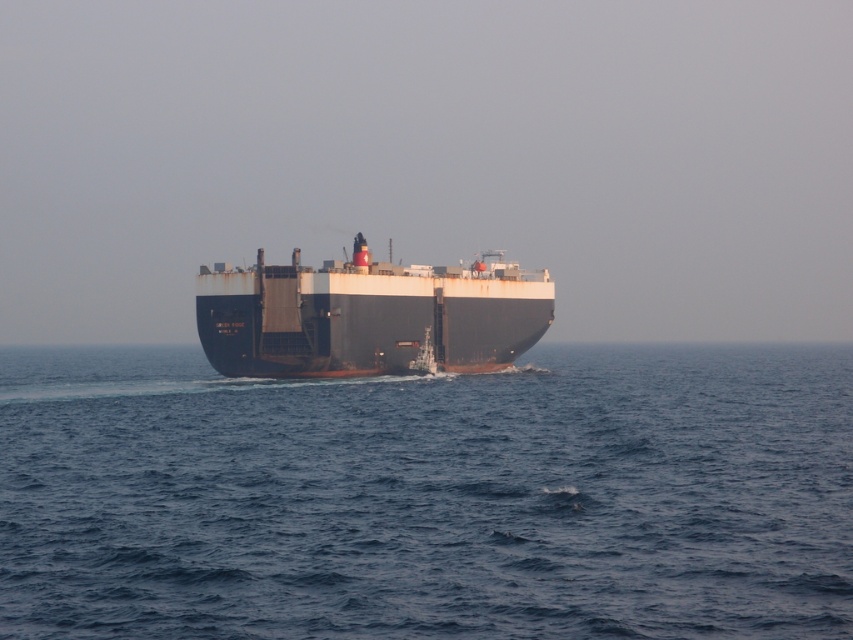
Question: Where is blue water at center located in relation to rustic metal ship at center in the image?

Choices:
 (A) right
 (B) left

Answer: (B)

Question: Which point is closer to the camera taking this photo?

Choices:
 (A) (837, 422)
 (B) (291, 275)

Answer: (A)

Question: Which of the following is the closest to the observer?

Choices:
 (A) (339, 288)
 (B) (695, 589)

Answer: (B)

Question: Is blue water at center wider than rustic metal ship at center?

Choices:
 (A) no
 (B) yes

Answer: (B)

Question: Which point is farther to the camera?

Choices:
 (A) (450, 307)
 (B) (422, 456)

Answer: (A)

Question: Observing the image, what is the correct spatial positioning of blue water at center in reference to rustic metal ship at center?

Choices:
 (A) above
 (B) below

Answer: (B)